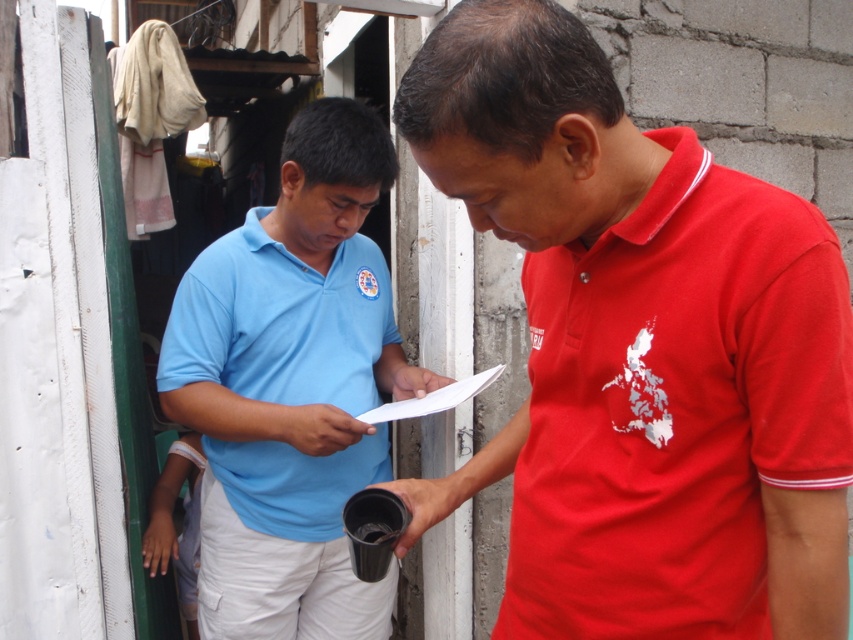
You are designing a new clothing line and want to ensure that the red and blue polo shirts have a balanced visual impact. Given the current design where the matte red polo shirt at center has a lesser width compared to the matte blue polo shirt at center, what adjustment could you make to the red polo shirt to achieve this balance?

To balance the visual impact, you could widen the matte red polo shirt at center to match the width of the matte blue polo shirt at center since the current red one is narrower.

You are a photographer trying to capture both the matte red polo shirt at center and the matte blue polo shirt at center in a single frame. Based on the scene, which of the two shirts is positioned higher in the image?

The matte red polo shirt at center is located above the matte blue polo shirt at center, so it is positioned higher in the image.